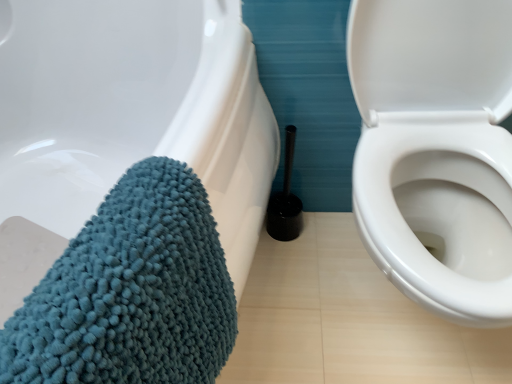
Question: Is black plastic toilet brush at center wider than teal chenille bath towel at lower left?

Choices:
 (A) yes
 (B) no

Answer: (B)

Question: Is black plastic toilet brush at center completely or partially outside of teal chenille bath towel at lower left?

Choices:
 (A) no
 (B) yes

Answer: (B)

Question: From a real-world perspective, is black plastic toilet brush at center located beneath teal chenille bath towel at lower left?

Choices:
 (A) yes
 (B) no

Answer: (A)

Question: Can you see black plastic toilet brush at center touching teal chenille bath towel at lower left?

Choices:
 (A) no
 (B) yes

Answer: (A)

Question: From the image's perspective, is black plastic toilet brush at center beneath teal chenille bath towel at lower left?

Choices:
 (A) no
 (B) yes

Answer: (A)

Question: Is black plastic toilet brush at center oriented away from teal chenille bath towel at lower left?

Choices:
 (A) no
 (B) yes

Answer: (A)

Question: Is teal chenille bath towel at lower left to the right of black plastic toilet brush at center from the viewer's perspective?

Choices:
 (A) no
 (B) yes

Answer: (A)

Question: Is teal chenille bath towel at lower left bigger than black plastic toilet brush at center?

Choices:
 (A) no
 (B) yes

Answer: (B)

Question: Can you confirm if teal chenille bath towel at lower left is wider than black plastic toilet brush at center?

Choices:
 (A) no
 (B) yes

Answer: (B)

Question: From a real-world perspective, is teal chenille bath towel at lower left on top of black plastic toilet brush at center?

Choices:
 (A) no
 (B) yes

Answer: (B)

Question: Is teal chenille bath towel at lower left positioned in front of black plastic toilet brush at center?

Choices:
 (A) no
 (B) yes

Answer: (B)

Question: Is the depth of teal chenille bath towel at lower left greater than that of black plastic toilet brush at center?

Choices:
 (A) no
 (B) yes

Answer: (A)

Question: Considering the positions of black plastic toilet brush at center and teal chenille bath towel at lower left in the image, is black plastic toilet brush at center taller or shorter than teal chenille bath towel at lower left?

Choices:
 (A) tall
 (B) short

Answer: (B)